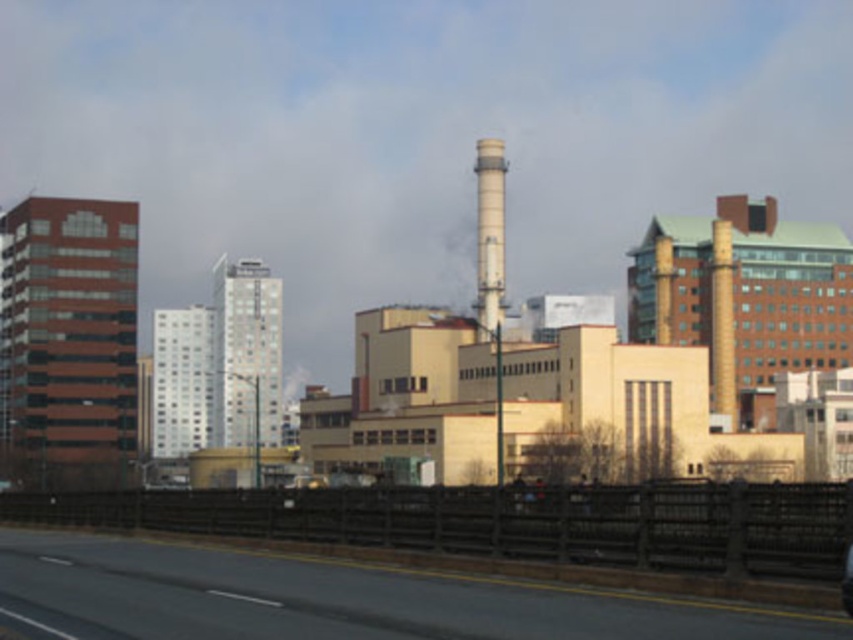
Question: Which of the following is the closest to the observer?

Choices:
 (A) click(216, 602)
 (B) click(502, 288)
 (C) click(848, 593)

Answer: (C)

Question: Among these points, which one is farthest from the camera?

Choices:
 (A) (480, 289)
 (B) (849, 604)
 (C) (206, 568)

Answer: (A)

Question: Estimate the real-world distances between objects in this image. Which object is closer to the shiny black car at center?

Choices:
 (A) white smooth chimney at center
 (B) black asphalt highway at lower center

Answer: (B)

Question: Does white smooth chimney at center have a greater width compared to shiny black car at center?

Choices:
 (A) no
 (B) yes

Answer: (B)

Question: Can you confirm if white smooth chimney at center is positioned above shiny black car at center?

Choices:
 (A) yes
 (B) no

Answer: (A)

Question: Does white smooth chimney at center appear over shiny black car at center?

Choices:
 (A) yes
 (B) no

Answer: (A)